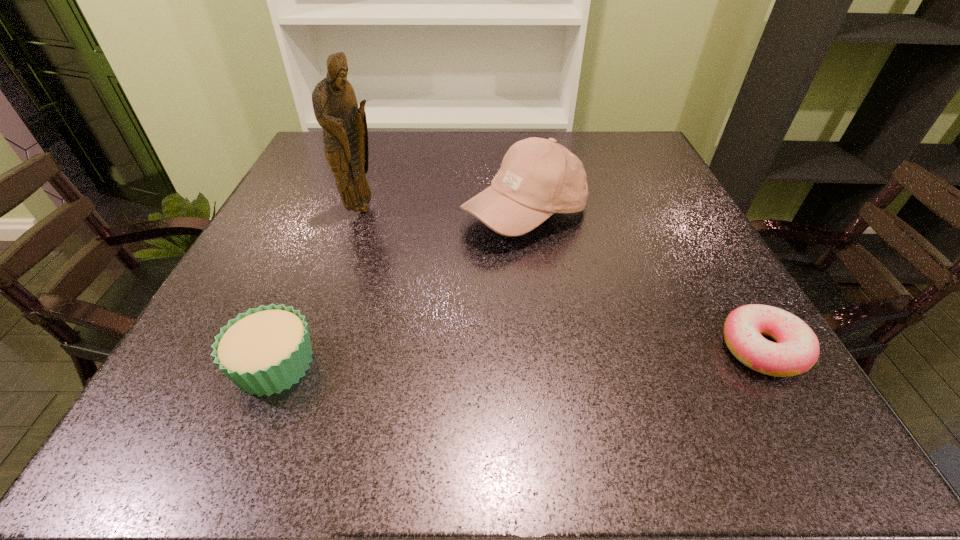
This screenshot has height=540, width=960. In order to click on object that is positioned at the near right corner in this screenshot , I will do `click(797, 349)`.

Identify the location of free space at the far edge of the desktop. The width and height of the screenshot is (960, 540). click(445, 154).

You are a GUI agent. You are given a task and a screenshot of the screen. Output one action in this format:
    pyautogui.click(x=<x>, y=<y>)
    Task: Click on the vacant region at the near edge of the desktop
    
    Given the screenshot: What is the action you would take?
    pyautogui.click(x=501, y=350)

What are the coordinates of `vacant space at the left edge` in the screenshot? It's located at coord(239,273).

The width and height of the screenshot is (960, 540). In the image, there is a desktop. In order to click on vacant space at the right edge in this screenshot , I will do `click(688, 237)`.

In order to click on vacant area at the far left corner of the desktop in this screenshot , I will do `click(304, 166)`.

In the image, there is a desktop. Where is `vacant space at the far right corner`? The image size is (960, 540). vacant space at the far right corner is located at coordinates (636, 134).

Find the location of a particular element. The image size is (960, 540). unoccupied position between the doughnut and the second tallest object is located at coordinates (644, 281).

Locate an element on the screen. The width and height of the screenshot is (960, 540). free spot between the shortest object and the third tallest object is located at coordinates (518, 356).

Identify the location of free space between the figurine and the third object from left to right. (444, 212).